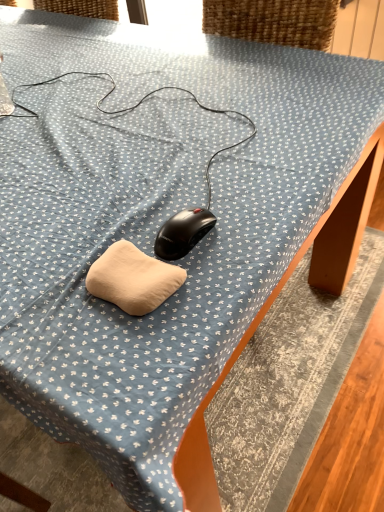
Consider the image. In order to face beige fabric pillow at center, should I rotate leftwards or rightwards?

A 5.851 degree turn to the left will do.

Identify the location of beige fabric pillow at center. The height and width of the screenshot is (512, 384). (133, 279).

What do you see at coordinates (133, 279) in the screenshot? The height and width of the screenshot is (512, 384). I see `beige fabric pillow at center` at bounding box center [133, 279].

This screenshot has height=512, width=384. Find the location of `beige fabric pillow at center`. beige fabric pillow at center is located at coordinates (133, 279).